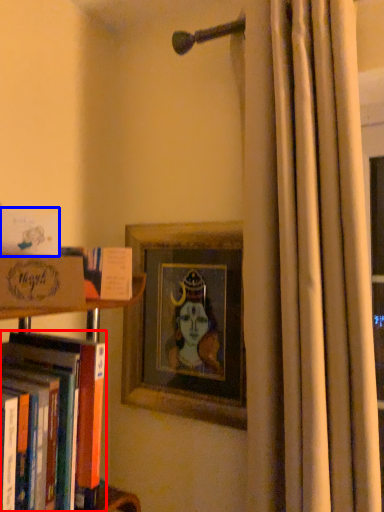
Question: Among these objects, which one is nearest to the camera, book (highlighted by a red box) or book (highlighted by a blue box)?

Choices:
 (A) book
 (B) book

Answer: (A)